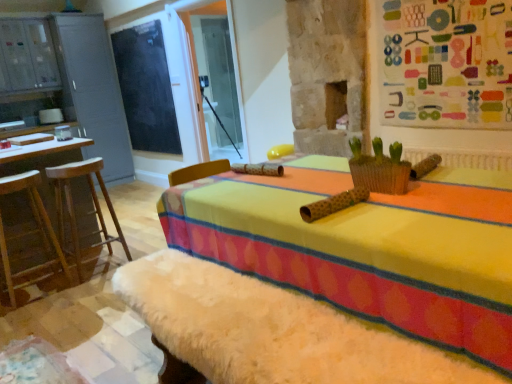
What do you see at coordinates (86, 213) in the screenshot? This screenshot has width=512, height=384. I see `wooden bar stool at left, the first furniture from the right` at bounding box center [86, 213].

Image resolution: width=512 pixels, height=384 pixels. Identify the location of matte gray cabinet at left. (67, 80).

Is woven brown basket at center facing towards wooden bar stool at left, the first furniture from the right?

No, woven brown basket at center does not turn towards wooden bar stool at left, the first furniture from the right.

From a real-world perspective, which object stands above the other?

In real-world perspective, woven brown basket at center is above.

Which is in front, point (365, 174) or point (129, 253)?

The point (365, 174) is more forward.

Identify the location of round table on the left of wooden bar stool at left, the first furniture from the right. (41, 150).

Looking at this image, who is smaller, wooden barstools at left or wooden bar stool at left, the first furniture from the right?

Answer: wooden bar stool at left, the first furniture from the right, is smaller.

Does wooden barstools at left have a greater width compared to wooden bar stool at left, which appears as the 2th furniture when viewed from the left?

Indeed, wooden barstools at left has a greater width compared to wooden bar stool at left, which appears as the 2th furniture when viewed from the left.

Could you tell me if wooden bar stool at left, which appears as the 2th furniture when viewed from the left, is turned towards matte gray cabinet at left?

No, wooden bar stool at left, which appears as the 2th furniture when viewed from the left, is not facing towards matte gray cabinet at left.

Is wooden bar stool at left, which appears as the 2th furniture when viewed from the left, in contact with matte gray cabinet at left?

There is a gap between wooden bar stool at left, which appears as the 2th furniture when viewed from the left, and matte gray cabinet at left.

From the picture: Does wooden bar stool at left, which appears as the 2th furniture when viewed from the left, appear on the left side of matte gray cabinet at left?

No, wooden bar stool at left, which appears as the 2th furniture when viewed from the left, is not to the left of matte gray cabinet at left.

From the image's perspective, which is above, wooden bar stool at left, the first furniture from the right, or matte gray cabinet at left?

matte gray cabinet at left is shown above in the image.

Does wooden stool at left, the second furniture in the right-to-left sequence, have a lesser width compared to woven brown basket at center?

No, wooden stool at left, the second furniture in the right-to-left sequence, is not thinner than woven brown basket at center.

Considering the sizes of objects wooden stool at left, which appears as the first furniture when viewed from the left, and woven brown basket at center in the image provided, who is taller, wooden stool at left, which appears as the first furniture when viewed from the left, or woven brown basket at center?

With more height is wooden stool at left, which appears as the first furniture when viewed from the left.

Could you tell me if wooden stool at left, the second furniture in the right-to-left sequence, is turned towards woven brown basket at center?

No, wooden stool at left, the second furniture in the right-to-left sequence, is not oriented towards woven brown basket at center.

From the image's perspective, which is above, wooden stool at left, the second furniture in the right-to-left sequence, or woven brown basket at center?

From the image's view, woven brown basket at center is above.

Could you tell me if matte gray cabinet at left is turned towards blackboard at upper left?

Yes, matte gray cabinet at left is oriented towards blackboard at upper left.

Looking at their sizes, would you say matte gray cabinet at left is wider or thinner than blackboard at upper left?

matte gray cabinet at left is wider than blackboard at upper left.

Between point (113, 69) and point (165, 150), which one is positioned behind?

Positioned behind is point (113, 69).

In the scene shown: Based on their positions, is matte gray cabinet at left located to the left or right of blackboard at upper left?

Based on their positions, matte gray cabinet at left is located to the left of blackboard at upper left.

In the image, is wooden bar stool at left, the first furniture from the right, on the left side or the right side of wooden stool at left, the second furniture in the right-to-left sequence?

Based on their positions, wooden bar stool at left, the first furniture from the right, is located to the right of wooden stool at left, the second furniture in the right-to-left sequence.

Is wooden bar stool at left, which appears as the 2th furniture when viewed from the left, not close to wooden stool at left, the second furniture in the right-to-left sequence?

They are positioned close to each other.

From a real-world perspective, does wooden bar stool at left, the first furniture from the right, stand above wooden stool at left, which appears as the first furniture when viewed from the left?

No, from a real-world perspective, wooden bar stool at left, the first furniture from the right, is not above wooden stool at left, which appears as the first furniture when viewed from the left.

Between wooden bar stool at left, the first furniture from the right, and wooden barstools at left, which one has larger size?

Bigger between the two is wooden barstools at left.

Considering the positions of objects wooden bar stool at left, the first furniture from the right, and wooden barstools at left in the image provided, who is more to the left, wooden bar stool at left, the first furniture from the right, or wooden barstools at left?

wooden barstools at left.

From a real-world perspective, is wooden bar stool at left, the first furniture from the right, physically below wooden barstools at left?

Yes, from a real-world perspective, wooden bar stool at left, the first furniture from the right, is below wooden barstools at left.

Is wooden bar stool at left, the first furniture from the right, closer to camera compared to wooden barstools at left?

No, wooden bar stool at left, the first furniture from the right, is further to the viewer.

This screenshot has width=512, height=384. What are the coordinates of `basket above the wooden bar stool at left, which appears as the 2th furniture when viewed from the left (from the image's perspective)` in the screenshot? It's located at (380, 174).

At what (x,y) coordinates should I click in order to perform the action: click on round table located above the wooden bar stool at left, which appears as the 2th furniture when viewed from the left (from a real-world perspective). Please return your answer as a coordinate pair (x, y). Looking at the image, I should click on (41, 150).

Looking at the image, which one is located further to woven brown basket at center, wooden barstools at left or blackboard at upper left?

The object further to woven brown basket at center is blackboard at upper left.

Based on their spatial positions, is wooden barstools at left or matte gray cabinet at left closer to wooden bar stool at left, the first furniture from the right?

Among the two, wooden barstools at left is located nearer to wooden bar stool at left, the first furniture from the right.

From the picture: Looking at the image, which one is located closer to wooden barstools at left, blackboard at upper left or woven brown basket at center?

blackboard at upper left is positioned closer to the anchor wooden barstools at left.

Which object lies further to the anchor point matte gray cabinet at left, woven brown basket at center or wooden bar stool at left, which appears as the 2th furniture when viewed from the left?

Based on the image, woven brown basket at center appears to be further to matte gray cabinet at left.

Estimate the real-world distances between objects in this image. Which object is closer to matte gray cabinet at left, wooden stool at left, which appears as the first furniture when viewed from the left, or wooden barstools at left?

The object closer to matte gray cabinet at left is wooden barstools at left.

Considering their positions, is matte gray cabinet at left positioned further to wooden bar stool at left, the first furniture from the right, than woven brown basket at center?

The object further to wooden bar stool at left, the first furniture from the right, is matte gray cabinet at left.

Which object lies further to the anchor point blackboard at upper left, wooden stool at left, the second furniture in the right-to-left sequence, or wooden bar stool at left, the first furniture from the right?

Among the two, wooden stool at left, the second furniture in the right-to-left sequence, is located further to blackboard at upper left.

Based on their spatial positions, is blackboard at upper left or wooden bar stool at left, which appears as the 2th furniture when viewed from the left, closer to wooden barstools at left?

Among the two, wooden bar stool at left, which appears as the 2th furniture when viewed from the left, is located nearer to wooden barstools at left.

Find the location of `round table positioned between wooden stool at left, the second furniture in the right-to-left sequence, and blackboard at upper left from near to far`. round table positioned between wooden stool at left, the second furniture in the right-to-left sequence, and blackboard at upper left from near to far is located at coordinates (41, 150).

Image resolution: width=512 pixels, height=384 pixels. Find the location of `furniture situated between wooden barstools at left and wooden bar stool at left, the first furniture from the right, from left to right`. furniture situated between wooden barstools at left and wooden bar stool at left, the first furniture from the right, from left to right is located at coordinates (30, 234).

Identify the location of furniture positioned between wooden stool at left, the second furniture in the right-to-left sequence, and matte gray cabinet at left from near to far. (86, 213).

At what (x,y) coordinates should I click in order to perform the action: click on furniture between wooden stool at left, the second furniture in the right-to-left sequence, and woven brown basket at center from left to right. Please return your answer as a coordinate pair (x, y). This screenshot has width=512, height=384. Looking at the image, I should click on (86, 213).